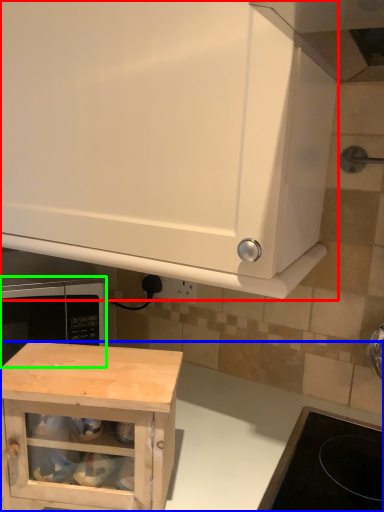
Question: Estimate the real-world distances between objects in this image. Which object is farther from cabinetry (highlighted by a red box), counter (highlighted by a blue box) or microwave oven (highlighted by a green box)?

Choices:
 (A) counter
 (B) microwave oven

Answer: (B)